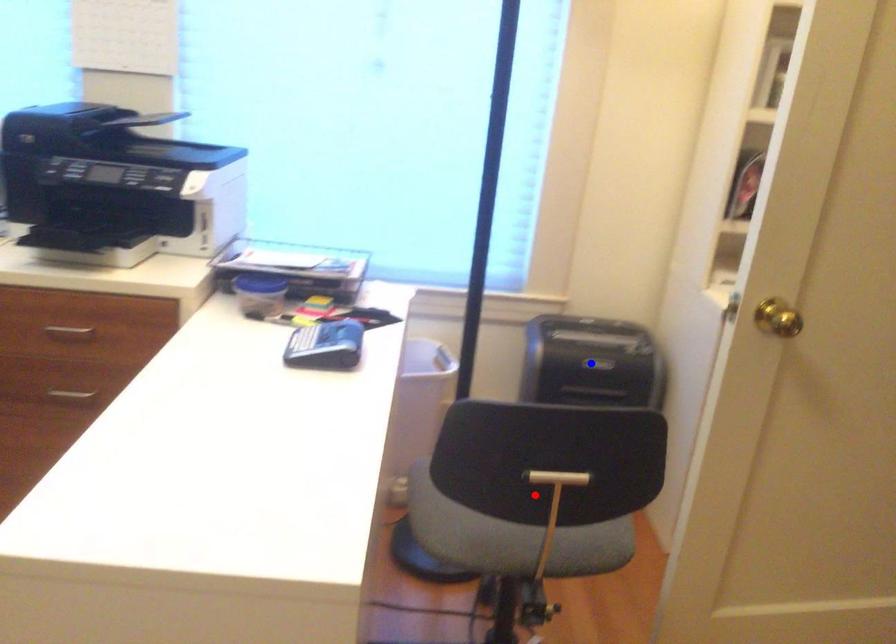
Question: Which of the two points in the image is closer to the camera?

Choices:
 (A) Blue point is closer.
 (B) Red point is closer.

Answer: (B)